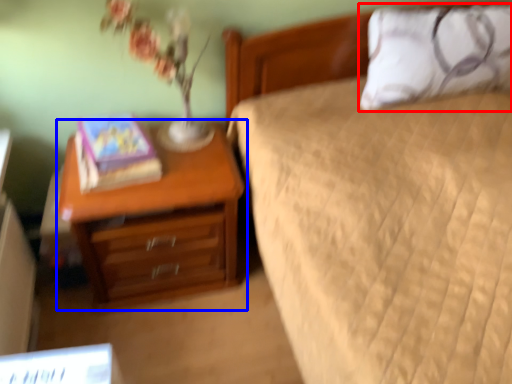
Question: Which object is closer to the camera taking this photo, pillow (highlighted by a red box) or nightstand (highlighted by a blue box)?

Choices:
 (A) pillow
 (B) nightstand

Answer: (B)